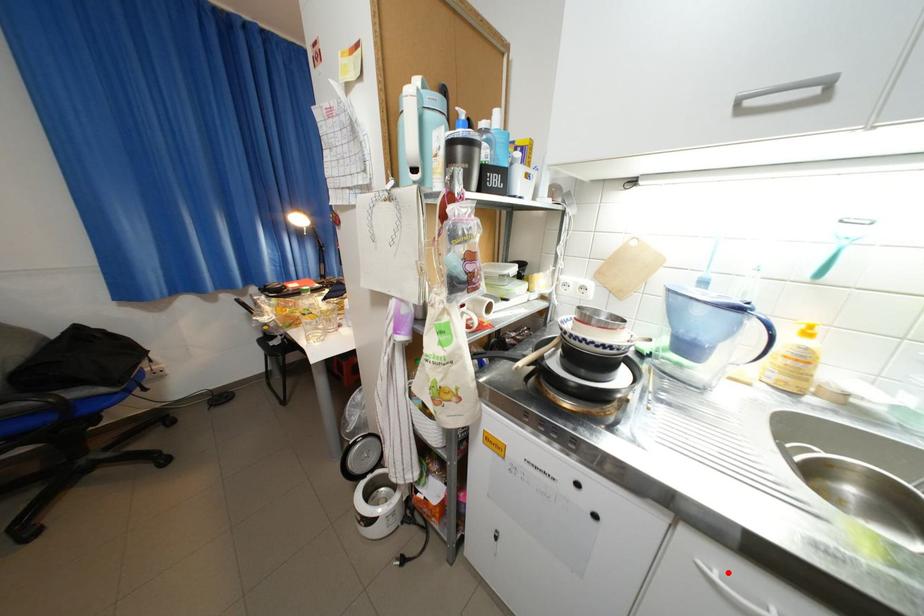
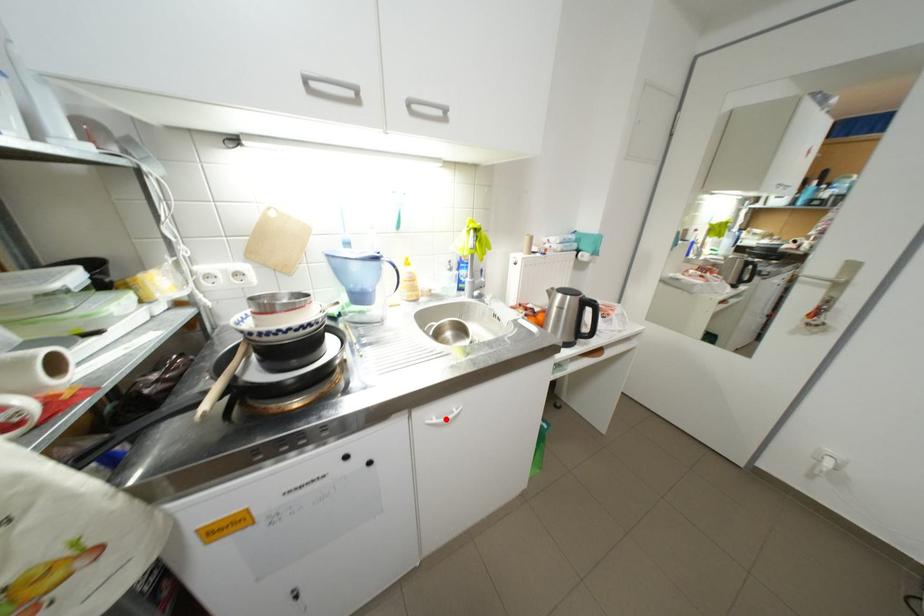
I am providing you with two images of the same scene from different viewpoints. A red point is marked on the first image and another point is marked on the second image. Are the points marked in image1 and image2 representing the same 3D position?

Yes